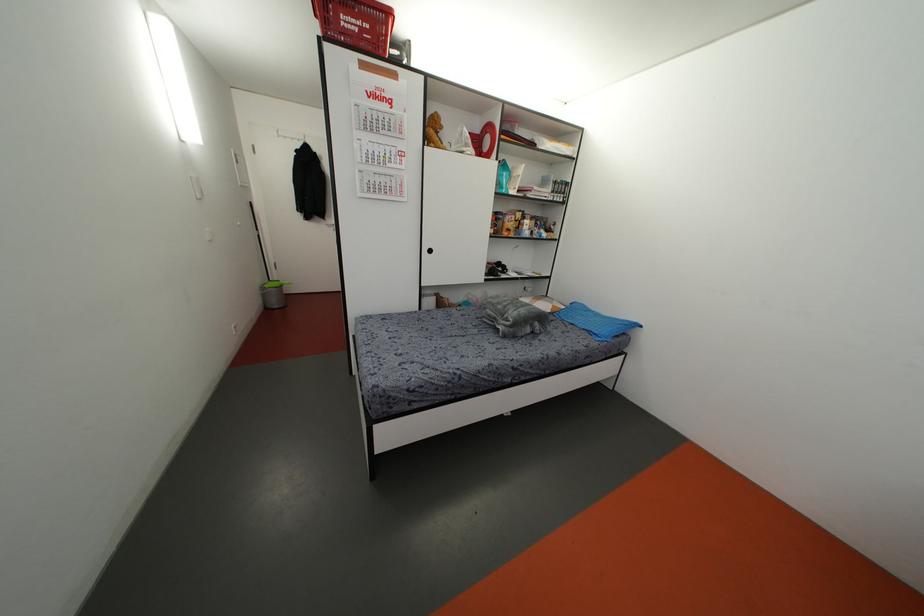
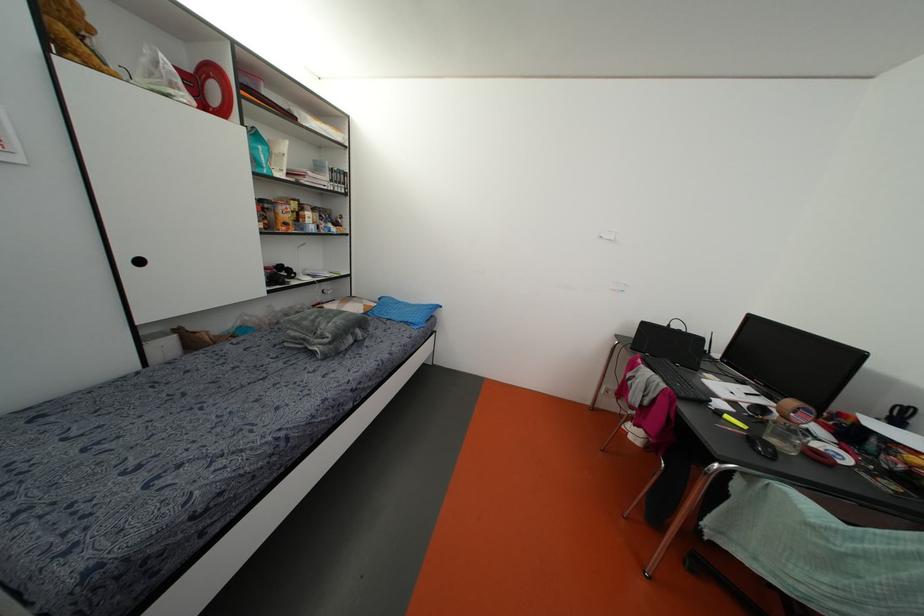
Question: The camera is either moving clockwise (left) or counter-clockwise (right) around the object. The first image is from the beginning of the video and the second image is from the end. Is the camera moving left or right when shooting the video?

Choices:
 (A) Left
 (B) Right

Answer: (A)